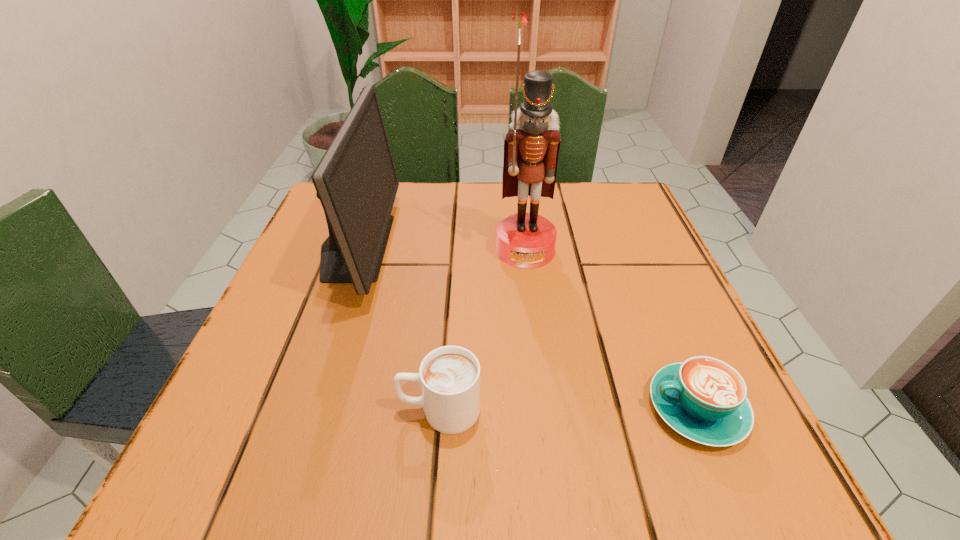
Where is `vacant region located 0.260m on the side with the handle of the left cappuccino`? This screenshot has width=960, height=540. vacant region located 0.260m on the side with the handle of the left cappuccino is located at coordinates (211, 409).

At what (x,y) coordinates should I click in order to perform the action: click on blank space located 0.190m on the side with the handle of the left cappuccino. Please return your answer as a coordinate pair (x, y). The width and height of the screenshot is (960, 540). Looking at the image, I should click on (262, 409).

Identify the location of free point located on the side with the handle of the left cappuccino. (276, 409).

Where is `free spot located 0.310m with the handle on the right side of the shorter cappuccino`? The width and height of the screenshot is (960, 540). free spot located 0.310m with the handle on the right side of the shorter cappuccino is located at coordinates (427, 408).

The width and height of the screenshot is (960, 540). Identify the location of vacant point located 0.160m with the handle on the right side of the shorter cappuccino. (535, 408).

Where is `vacant space situated 0.260m with the handle on the right side of the shorter cappuccino`? The image size is (960, 540). vacant space situated 0.260m with the handle on the right side of the shorter cappuccino is located at coordinates (463, 408).

The image size is (960, 540). I want to click on nutcracker situated at the far edge, so click(x=526, y=240).

Where is `computer monitor located at the far edge`? The image size is (960, 540). computer monitor located at the far edge is located at coordinates (356, 181).

The width and height of the screenshot is (960, 540). I want to click on object at the left edge, so click(x=356, y=181).

Identify the location of object located at the right edge. (704, 399).